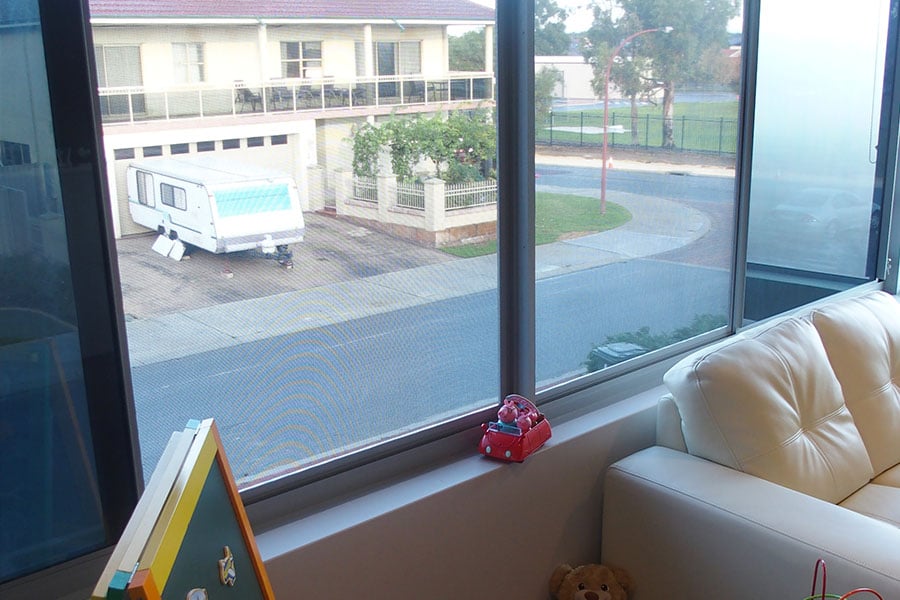
Locate an element on the screen. This screenshot has width=900, height=600. couch coushions is located at coordinates (733, 392), (876, 320).